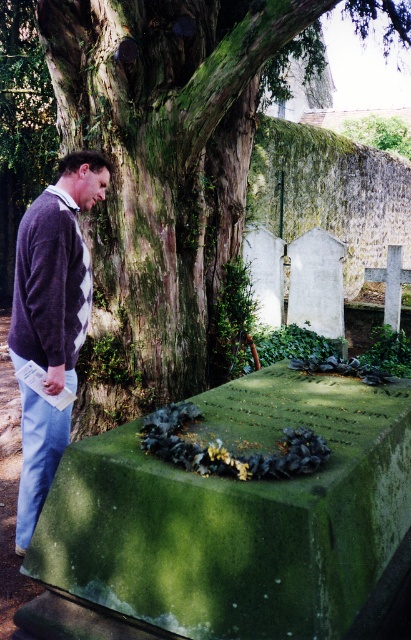
Is point (205, 241) positioned behind point (11, 321)?

Yes, it is behind point (11, 321).

You are a GUI agent. You are given a task and a screenshot of the screen. Output one action in this format:
    pyautogui.click(x=<x>, y=<y>)
    Task: Click on the green mossy tree trunk at upper left
    
    Given the screenshot: What is the action you would take?
    pyautogui.click(x=161, y=172)

Who is higher up, green mossy stone at center or dark purple sweater at left?

dark purple sweater at left is above.

Does green mossy stone at center appear under dark purple sweater at left?

Indeed, green mossy stone at center is positioned under dark purple sweater at left.

Where is `green mossy stone at center`? This screenshot has width=411, height=640. green mossy stone at center is located at coordinates (226, 522).

Who is positioned more to the left, dark purple sweater at left or dark purple argyle sweater at left?

dark purple sweater at left

Is the position of dark purple sweater at left more distant than that of dark purple argyle sweater at left?

Yes, it is.

Is point (80, 257) behind point (90, 285)?

No, it is in front of (90, 285).

Locate an element on the screen. dark purple sweater at left is located at coordinates (55, 272).